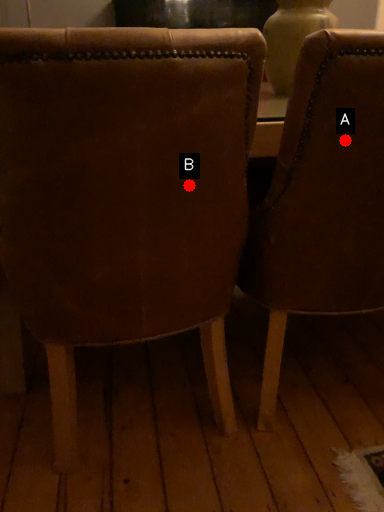
Question: Two points are circled on the image, labeled by A and B beside each circle. Which point is farther to the camera?

Choices:
 (A) A is further
 (B) B is further

Answer: (A)